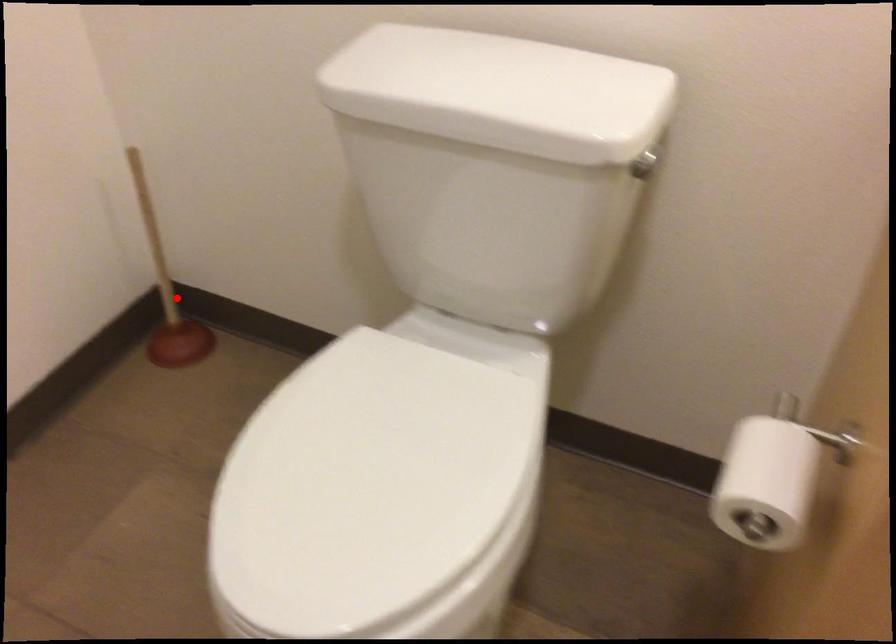
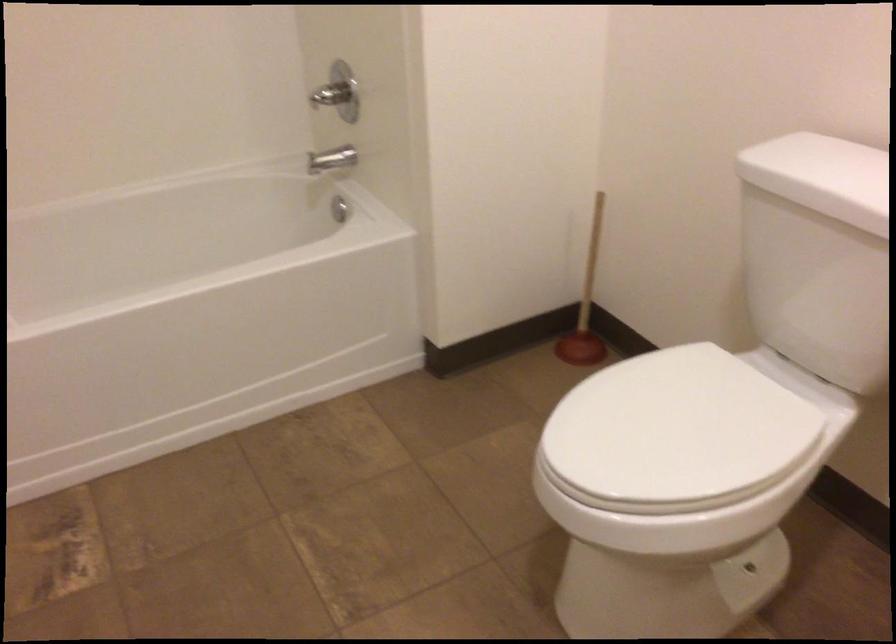
Question: I am providing you with two images of the same scene from different viewpoints. A red point is shown in image1. For the corresponding object point in image2, is it positioned nearer or farther from the camera?

Choices:
 (A) Nearer
 (B) Farther

Answer: (B)